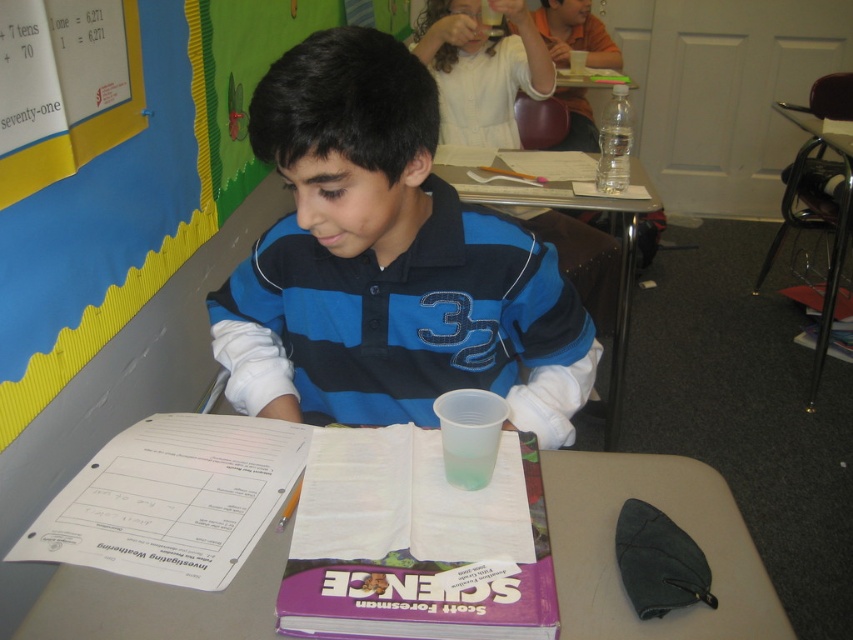
Consider the image. Does blue striped polo shirt at center appear on the right side of yellow paper at upper left?

Yes, blue striped polo shirt at center is to the right of yellow paper at upper left.

Does blue striped polo shirt at center have a greater width compared to yellow paper at upper left?

Yes.

The width and height of the screenshot is (853, 640). Describe the element at coordinates (387, 262) in the screenshot. I see `blue striped polo shirt at center` at that location.

The width and height of the screenshot is (853, 640). Find the location of `blue striped polo shirt at center`. blue striped polo shirt at center is located at coordinates (387, 262).

Consider the image. Who is taller, yellow paper at upper left or translucent plastic cup at center?

yellow paper at upper left is taller.

Is yellow paper at upper left below translucent plastic cup at center?

No, yellow paper at upper left is not below translucent plastic cup at center.

Image resolution: width=853 pixels, height=640 pixels. Identify the location of yellow paper at upper left. (144, 188).

Does blue striped polo shirt at center have a lesser width compared to clear plastic cup at upper center?

No, blue striped polo shirt at center is not thinner than clear plastic cup at upper center.

Who is shorter, blue striped polo shirt at center or clear plastic cup at upper center?

blue striped polo shirt at center is shorter.

Between point (234, 349) and point (593, 209), which one is positioned behind?

Point (593, 209)

Identify the location of blue striped polo shirt at center. This screenshot has width=853, height=640. (387, 262).